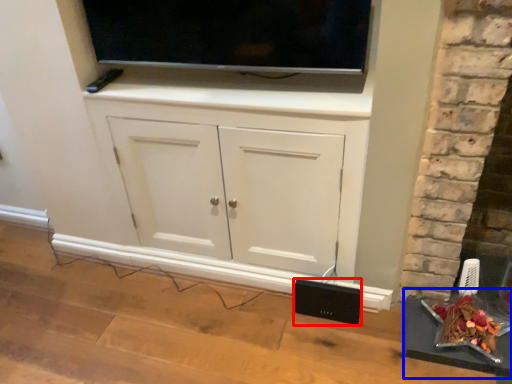
Question: Which of the following is the closest to the observer, speaker (highlighted by a red box) or table (highlighted by a blue box)?

Choices:
 (A) speaker
 (B) table

Answer: (B)